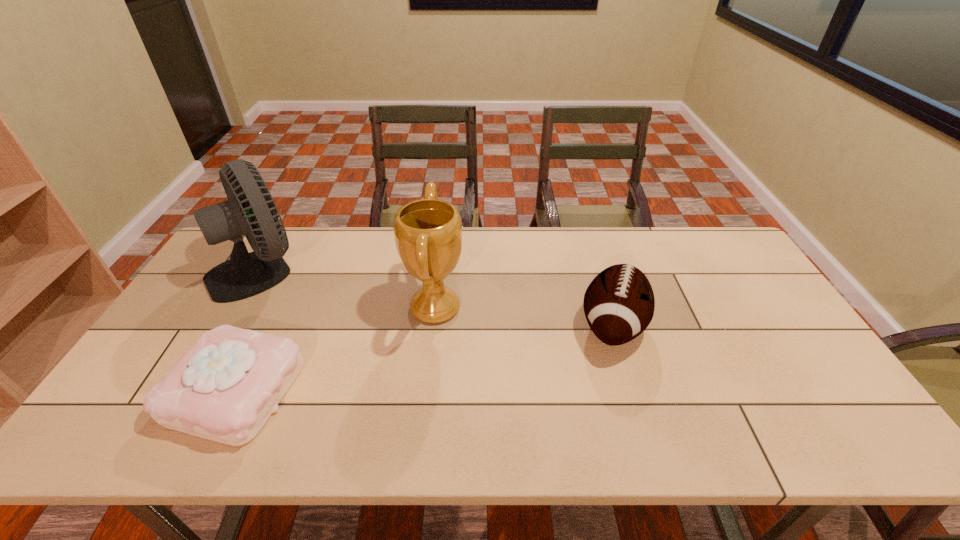
Identify the location of free space that is in between the second object from right to left and the third tallest object. This screenshot has height=540, width=960. (524, 317).

Find the location of a particular element. This screenshot has width=960, height=540. empty space that is in between the second object from right to left and the cake is located at coordinates (336, 349).

The height and width of the screenshot is (540, 960). Identify the location of free space between the cake and the award. (336, 349).

Where is `empty space that is in between the fan and the second object from right to left`? The height and width of the screenshot is (540, 960). empty space that is in between the fan and the second object from right to left is located at coordinates (348, 288).

The height and width of the screenshot is (540, 960). Identify the location of empty location between the award and the fan. (348, 288).

Where is `unoccupied position between the second object from right to left and the shortest object`? This screenshot has width=960, height=540. unoccupied position between the second object from right to left and the shortest object is located at coordinates (336, 349).

In order to click on vacant area between the second shortest object and the award in this screenshot , I will do `click(524, 317)`.

Where is `object that stands as the third closest to the third tallest object`? The image size is (960, 540). object that stands as the third closest to the third tallest object is located at coordinates (250, 210).

Locate which object is the third closest to the football (American). Please provide its 2D coordinates. Your answer should be formatted as a tuple, i.e. [(x, y)], where the tuple contains the x and y coordinates of a point satisfying the conditions above.

[(250, 210)]

The image size is (960, 540). What are the coordinates of `vacant region that satisfies the following two spatial constraints: 1. on the front of the award with the decoration; 2. on the right side of the rightmost object` in the screenshot? It's located at (433, 326).